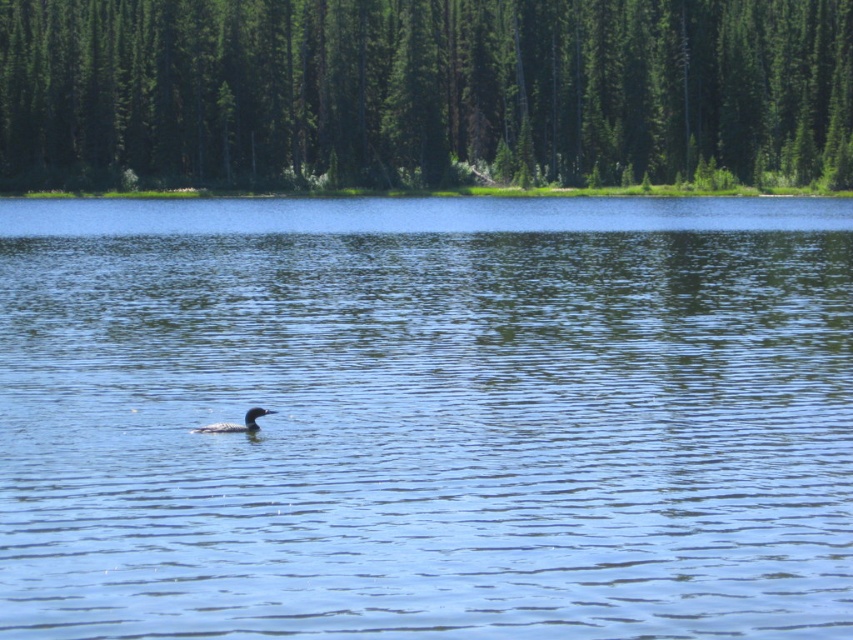
Question: Where is blue water at center located in relation to green textured trees at upper center in the image?

Choices:
 (A) left
 (B) right

Answer: (B)

Question: Does blue water at center appear on the right side of dark gray matte duck at center?

Choices:
 (A) no
 (B) yes

Answer: (A)

Question: Estimate the real-world distances between objects in this image. Which object is farther from the blue water at center?

Choices:
 (A) dark gray matte duck at center
 (B) green textured trees at upper center

Answer: (B)

Question: Can you confirm if blue water at center is smaller than dark gray matte duck at center?

Choices:
 (A) yes
 (B) no

Answer: (B)

Question: Which object is the closest to the blue water at center?

Choices:
 (A) green textured trees at upper center
 (B) dark gray matte duck at center

Answer: (B)

Question: Which object is the farthest from the dark gray matte duck at center?

Choices:
 (A) green textured trees at upper center
 (B) blue water at center

Answer: (A)